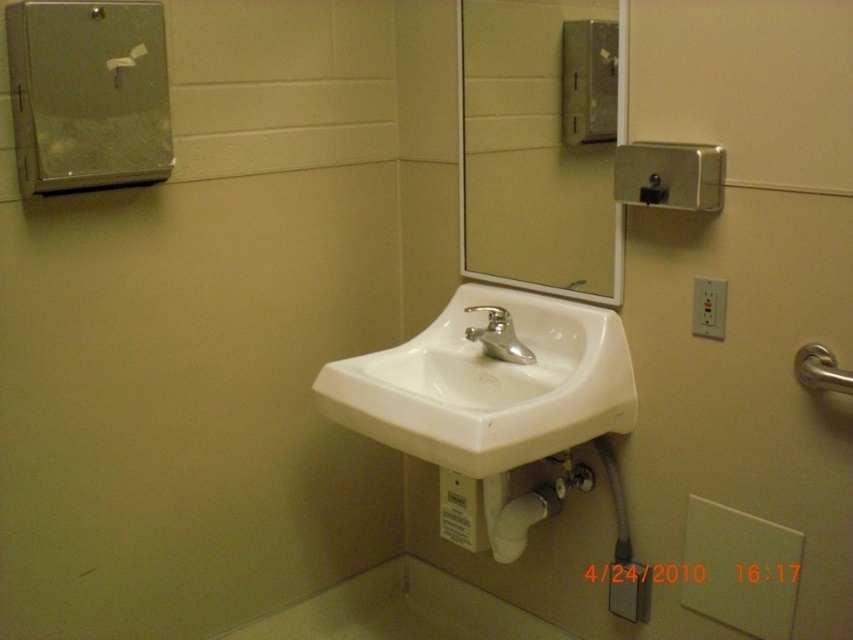
Which is more to the right, white ceramic sink at center or metallic silver hand dryer at upper left?

Positioned to the right is white ceramic sink at center.

Does white ceramic sink at center have a lesser width compared to metallic silver hand dryer at upper left?

Incorrect, white ceramic sink at center's width is not less than metallic silver hand dryer at upper left's.

Who is more forward, (x=416, y=413) or (x=86, y=54)?

Positioned in front is point (x=86, y=54).

You are a GUI agent. You are given a task and a screenshot of the screen. Output one action in this format:
    pyautogui.click(x=<x>, y=<y>)
    Task: Click on the white ceramic sink at center
    This screenshot has height=640, width=853.
    Given the screenshot: What is the action you would take?
    pyautogui.click(x=489, y=385)

Does clear glass mirror at upper center appear over silver metallic faucet at center?

Yes.

Does clear glass mirror at upper center have a smaller size compared to silver metallic faucet at center?

Incorrect, clear glass mirror at upper center is not smaller in size than silver metallic faucet at center.

Which is behind, point (577, 228) or point (570, 289)?

The point (570, 289) is behind.

This screenshot has height=640, width=853. Find the location of `clear glass mirror at upper center`. clear glass mirror at upper center is located at coordinates (531, 156).

Between satin nickel faucet at center and silver metallic faucet at center, which one appears on the right side from the viewer's perspective?

From the viewer's perspective, silver metallic faucet at center appears more on the right side.

Is satin nickel faucet at center to the right of silver metallic faucet at center from the viewer's perspective?

No, satin nickel faucet at center is not to the right of silver metallic faucet at center.

I want to click on satin nickel faucet at center, so click(498, 337).